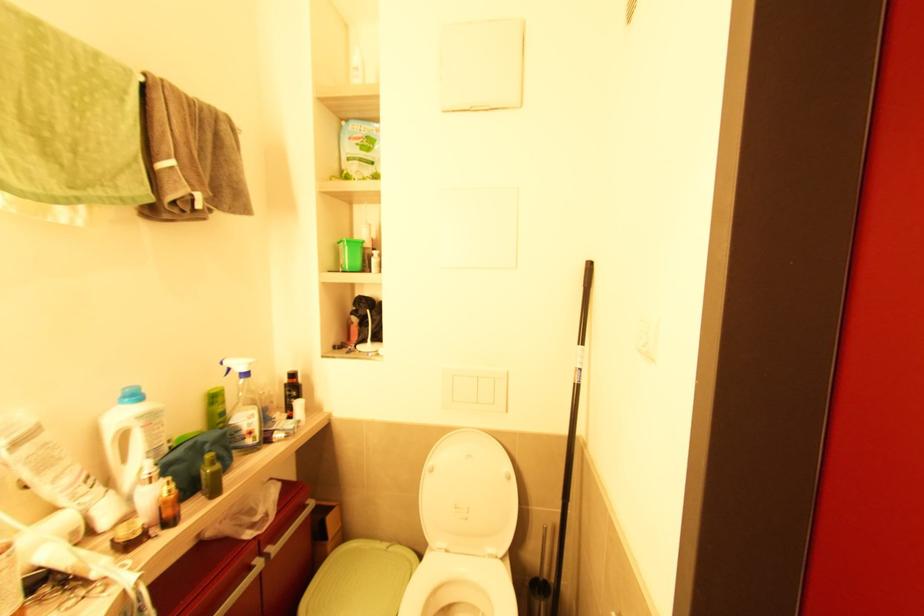
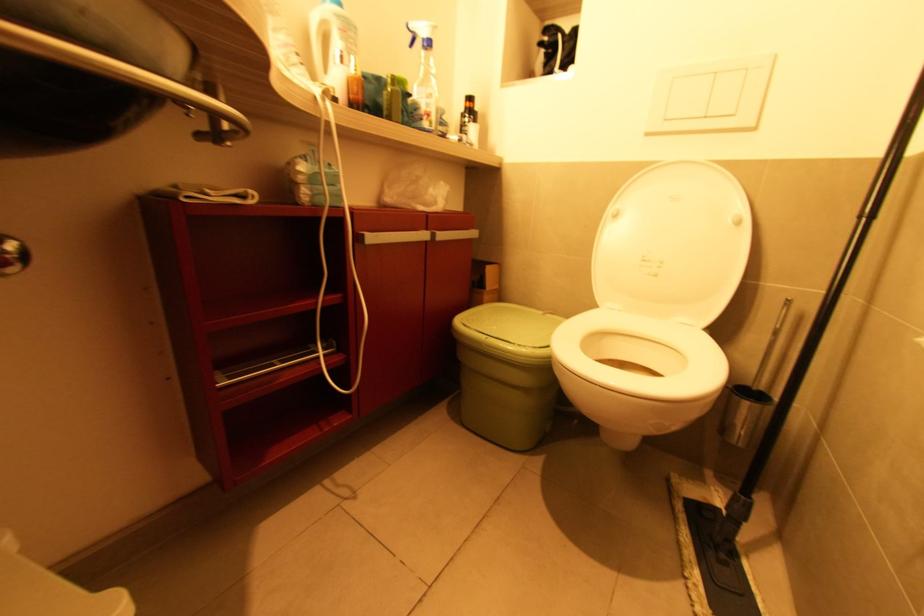
Find the pixel in the second image that matches (x=432, y=472) in the first image.

(617, 217)